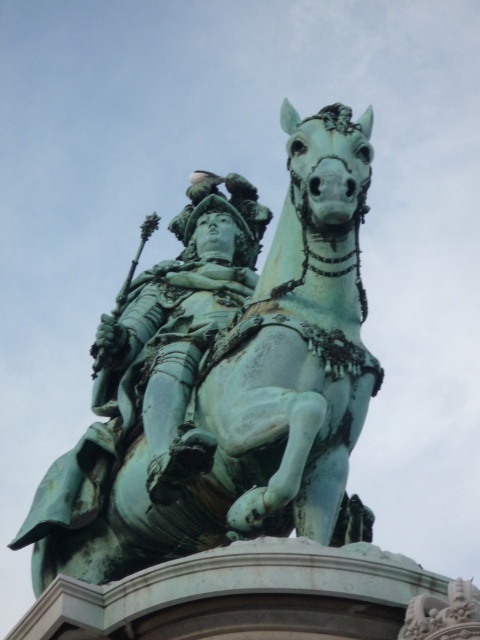
Is green patinated bronze statue at center taller than green patinated metal statue at center?

Yes, green patinated bronze statue at center is taller than green patinated metal statue at center.

Does point (252, 458) lie in front of point (204, 451)?

No, (252, 458) is further to viewer.

Does point (154, 499) come farther from viewer compared to point (134, 332)?

No, (154, 499) is in front of (134, 332).

Locate an element on the screen. green patinated bronze statue at center is located at coordinates (227, 380).